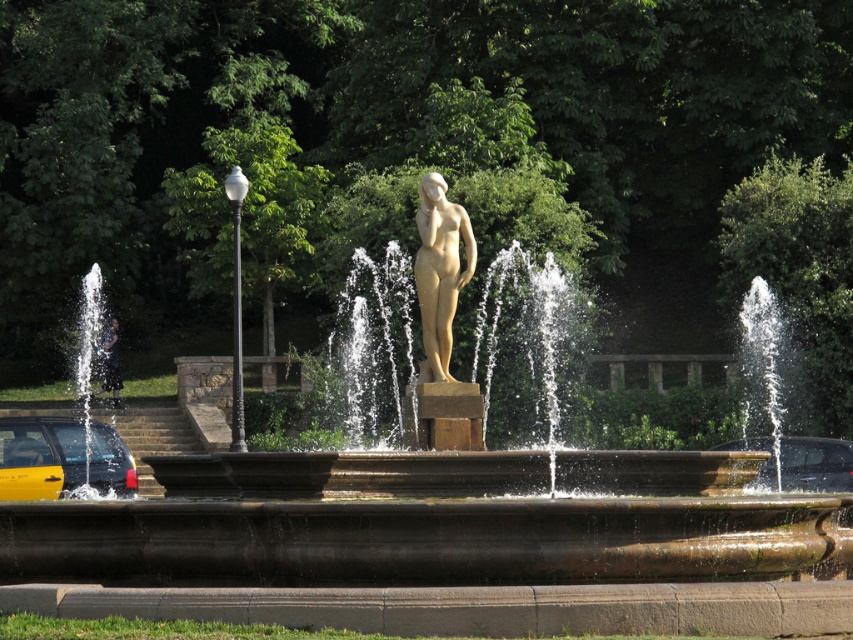
Question: Which of the following is the closest to the observer?

Choices:
 (A) (584, 461)
 (B) (842, 472)
 (C) (90, 460)

Answer: (A)

Question: In this image, where is gold statue at center located relative to yellow matte taxi at lower left?

Choices:
 (A) above
 (B) below

Answer: (A)

Question: Does yellow matte taxi at lower left appear on the right side of metallic silver car at lower right?

Choices:
 (A) no
 (B) yes

Answer: (A)

Question: Estimate the real-world distances between objects in this image. Which object is closer to the metallic silver car at lower right?

Choices:
 (A) yellow matte taxi at lower left
 (B) matte gold statue at center
 (C) gold statue at center

Answer: (B)

Question: Which point is closer to the camera?

Choices:
 (A) (93, 472)
 (B) (838, 440)

Answer: (A)

Question: Is yellow matte taxi at lower left behind metallic silver car at lower right?

Choices:
 (A) no
 (B) yes

Answer: (A)